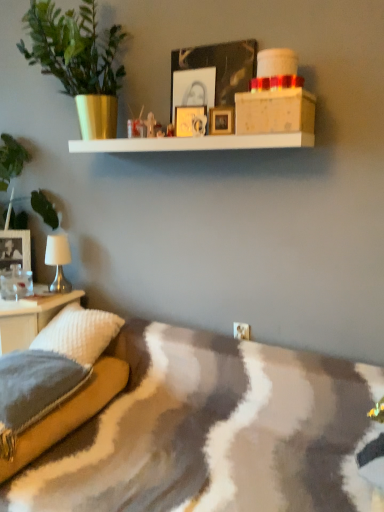
Question: Considering the relative sizes of green matte plant at left and wooden picture frame at upper center, which ranks as the 2th picture frame in top-to-bottom order, in the image provided, is green matte plant at left shorter than wooden picture frame at upper center, which ranks as the 2th picture frame in top-to-bottom order,?

Choices:
 (A) yes
 (B) no

Answer: (B)

Question: Is green matte plant at left outside of wooden picture frame at upper center, arranged as the 3th picture frame when viewed from the back?

Choices:
 (A) yes
 (B) no

Answer: (A)

Question: Is green matte plant at left far away from wooden picture frame at upper center, arranged as the third picture frame when viewed from the right?

Choices:
 (A) no
 (B) yes

Answer: (A)

Question: Is green matte plant at left closer to camera compared to wooden picture frame at upper center, which appears as the 3th picture frame when ordered from the bottom?

Choices:
 (A) yes
 (B) no

Answer: (A)

Question: Does green matte plant at left have a greater width compared to wooden picture frame at upper center, which ranks as the 2th picture frame in top-to-bottom order?

Choices:
 (A) no
 (B) yes

Answer: (B)

Question: Is point (46, 1) positioned closer to the camera than point (36, 390)?

Choices:
 (A) closer
 (B) farther

Answer: (B)

Question: Is green matte plant at left situated inside textured gray pillow at lower left, the 1th pillow positioned from the front, or outside?

Choices:
 (A) inside
 (B) outside

Answer: (B)

Question: Visually, is green matte plant at left positioned to the left or to the right of textured gray pillow at lower left, the second pillow when ordered from back to front?

Choices:
 (A) right
 (B) left

Answer: (A)

Question: In terms of size, does green matte plant at left appear bigger or smaller than textured gray pillow at lower left, the second pillow when ordered from back to front?

Choices:
 (A) small
 (B) big

Answer: (B)

Question: Looking at their shapes, would you say green leafy plant at left is wider or thinner than green matte plant at left?

Choices:
 (A) wide
 (B) thin

Answer: (B)

Question: From a real-world perspective, is green leafy plant at left physically located above or below green matte plant at left?

Choices:
 (A) below
 (B) above

Answer: (A)

Question: From the image's perspective, relative to green matte plant at left, is green leafy plant at left above or below?

Choices:
 (A) below
 (B) above

Answer: (A)

Question: Is green leafy plant at left taller or shorter than green matte plant at left?

Choices:
 (A) tall
 (B) short

Answer: (A)

Question: In the image, is white glossy table at lower left positioned in front of or behind green matte plant at left?

Choices:
 (A) behind
 (B) front

Answer: (A)

Question: From a real-world perspective, is white glossy table at lower left positioned above or below green matte plant at left?

Choices:
 (A) above
 (B) below

Answer: (B)